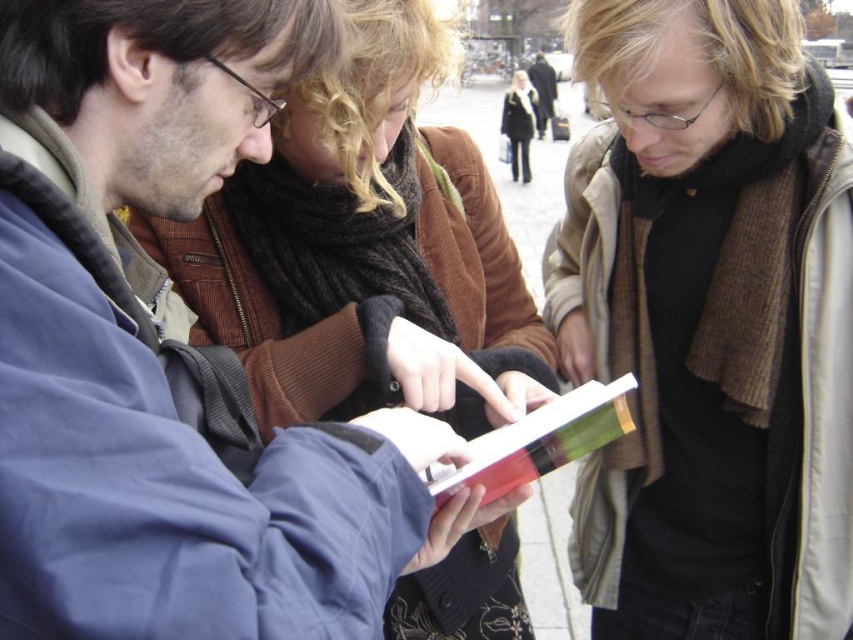
Between brown wool scarf at center and red glossy book at center, which one appears on the left side from the viewer's perspective?

brown wool scarf at center

Does brown wool scarf at center lie behind red glossy book at center?

No, it is in front of red glossy book at center.

Where is `brown wool scarf at center`? brown wool scarf at center is located at coordinates (364, 248).

Find the location of a particular element. This screenshot has width=853, height=640. brown wool scarf at center is located at coordinates (364, 248).

Does brown wool scarf at center have a greater width compared to black wool coat at upper center?

Yes, brown wool scarf at center is wider than black wool coat at upper center.

Can you confirm if brown wool scarf at center is positioned to the right of black wool coat at upper center?

In fact, brown wool scarf at center is to the left of black wool coat at upper center.

Is point (415, 264) farther from viewer compared to point (515, 148)?

No, it is not.

This screenshot has width=853, height=640. Identify the location of brown wool scarf at center. (364, 248).

Between red glossy book at center and black wool coat at upper center, which one is positioned lower?

red glossy book at center is below.

Does red glossy book at center have a smaller size compared to black wool coat at upper center?

Correct, red glossy book at center occupies less space than black wool coat at upper center.

Between point (537, 422) and point (527, 112), which one is positioned behind?

The point (527, 112) is more distant.

You are a GUI agent. You are given a task and a screenshot of the screen. Output one action in this format:
    pyautogui.click(x=<x>, y=<y>)
    Task: Click on the red glossy book at center
    The height and width of the screenshot is (640, 853).
    Given the screenshot: What is the action you would take?
    pyautogui.click(x=538, y=442)